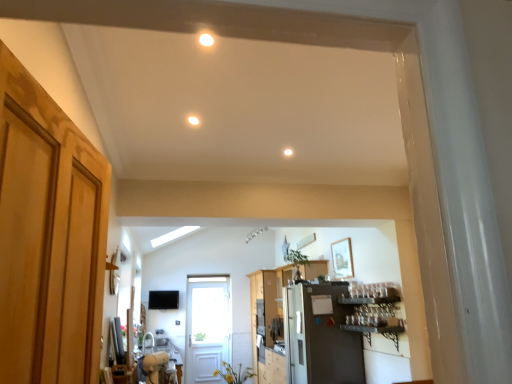
Locate an element on the screen. The height and width of the screenshot is (384, 512). metallic gray shelf at right is located at coordinates (375, 313).

Where is `matte white light fixture at center, arranged as the 2th lighting when viewed from the top`? Image resolution: width=512 pixels, height=384 pixels. matte white light fixture at center, arranged as the 2th lighting when viewed from the top is located at coordinates (193, 121).

Considering the relative positions of wooden cabinet at center and metallic gray shelf at right in the image provided, is wooden cabinet at center to the left or to the right of metallic gray shelf at right?

From the image, it's evident that wooden cabinet at center is to the left of metallic gray shelf at right.

Considering the sizes of objects wooden cabinet at center and metallic gray shelf at right in the image provided, who is taller, wooden cabinet at center or metallic gray shelf at right?

wooden cabinet at center.

In order to click on cabinetry behind the metallic gray shelf at right in this screenshot , I will do `click(267, 315)`.

Between point (261, 333) and point (355, 328), which one is positioned in front?

The point (355, 328) is closer.

From the image's perspective, is white matte light fixture at center, the first lighting in the bottom-to-top sequence, on white glossy light fixture at upper center, acting as the 1th lighting starting from the top?

No.

Does white matte light fixture at center, placed as the 3th lighting when sorted from top to bottom, touch white glossy light fixture at upper center, positioned as the 2th lighting in right-to-left order?

No, white matte light fixture at center, placed as the 3th lighting when sorted from top to bottom, is not next to white glossy light fixture at upper center, positioned as the 2th lighting in right-to-left order.

Is white matte light fixture at center, placed as the 3th lighting when sorted from top to bottom, inside or outside of white glossy light fixture at upper center, the 1th lighting from the front?

white matte light fixture at center, placed as the 3th lighting when sorted from top to bottom, is not enclosed by white glossy light fixture at upper center, the 1th lighting from the front.

In terms of height, does light brown wood door at left, which is the 1th door from top to bottom, look taller or shorter compared to wooden cabinet at center?

In the image, light brown wood door at left, which is the 1th door from top to bottom, appears to be shorter than wooden cabinet at center.

From the image's perspective, relative to wooden cabinet at center, is light brown wood door at left, which is the 1th door from top to bottom, above or below?

Clearly, from the image's perspective, light brown wood door at left, which is the 1th door from top to bottom, is above wooden cabinet at center.

In the scene shown: Can you tell me how much light brown wood door at left, the second door from the bottom, and wooden cabinet at center differ in facing direction?

170 degrees separate the facing orientations of light brown wood door at left, the second door from the bottom, and wooden cabinet at center.

The height and width of the screenshot is (384, 512). I want to click on door in front of the wooden cabinet at center, so click(x=48, y=237).

Is white matte light fixture at center, placed as the 3th lighting when sorted from top to bottom, bigger than white glossy sink at lower left?

No, white matte light fixture at center, placed as the 3th lighting when sorted from top to bottom, is not bigger than white glossy sink at lower left.

How different are the orientations of white matte light fixture at center, arranged as the 1th lighting when viewed from the right, and white glossy sink at lower left in degrees?

The angle between the facing direction of white matte light fixture at center, arranged as the 1th lighting when viewed from the right, and the facing direction of white glossy sink at lower left is 76.1 degrees.

Consider the image. Considering the relative positions of white matte light fixture at center, which is the first lighting in back-to-front order, and white glossy sink at lower left in the image provided, is white matte light fixture at center, which is the first lighting in back-to-front order, to the right of white glossy sink at lower left from the viewer's perspective?

Indeed, white matte light fixture at center, which is the first lighting in back-to-front order, is positioned on the right side of white glossy sink at lower left.

Can you confirm if white matte light fixture at center, arranged as the 1th lighting when viewed from the right, is wider than white glossy sink at lower left?

No.

From a real-world perspective, is light brown wood door at left, the first door in the front-to-back sequence, positioned above or below white matte light fixture at center, which is the first lighting in back-to-front order?

From a real-world perspective, light brown wood door at left, the first door in the front-to-back sequence, is physically below white matte light fixture at center, which is the first lighting in back-to-front order.

How distant is light brown wood door at left, the first door in the front-to-back sequence, from white matte light fixture at center, the first lighting in the bottom-to-top sequence?

They are 8.58 feet apart.

Is point (0, 145) less distant than point (283, 152)?

Yes, it is.

Identify the location of the 2nd lighting above the metallic gray shelf at right (from a real-world perspective). (193, 121).

Is the surface of matte white light fixture at center, the first lighting in the left-to-right sequence, in direct contact with metallic gray shelf at right?

matte white light fixture at center, the first lighting in the left-to-right sequence, is not next to metallic gray shelf at right, and they're not touching.

Between matte white light fixture at center, which ranks as the second lighting in back-to-front order, and metallic gray shelf at right, which one has larger size?

metallic gray shelf at right is bigger.

Considering the positions of point (194, 120) and point (393, 319), is point (194, 120) closer or farther from the camera than point (393, 319)?

Point (194, 120) is closer to the camera than point (393, 319).

Consider the image. From a real-world perspective, who is located higher, white wooden door at center, which is counted as the first door, starting from the back, or light brown wood door at left, the second door from the bottom?

In real-world perspective, light brown wood door at left, the second door from the bottom, is above.

Is white wooden door at center, the first door in the left-to-right sequence, facing towards light brown wood door at left, the second door from the bottom?

Yes, white wooden door at center, the first door in the left-to-right sequence, is oriented towards light brown wood door at left, the second door from the bottom.

Identify the location of cabinetry on the left of metallic gray shelf at right. tap(267, 315).

From the image's perspective, which lighting is the 2nd one below the white glossy light fixture at upper center, acting as the second lighting starting from the left? Please provide its 2D coordinates.

[(288, 152)]

From the image, which object appears to be farther from wooden cabinet at center, white matte light fixture at center, the 3th lighting from the front, or white wooden door at center, placed as the 2th door when sorted from front to back?

white matte light fixture at center, the 3th lighting from the front.

From the image, which object appears to be farther from matte white light fixture at center, arranged as the 2th lighting when viewed from the top, white matte light fixture at center, the third lighting viewed from the left, or metallic gray shelf at right?

metallic gray shelf at right.

Looking at the image, which one is located further to metallic gray shelf at right, white matte light fixture at center, the third lighting viewed from the left, or white glossy table at lower center?

white glossy table at lower center is positioned further to the anchor metallic gray shelf at right.

Based on their spatial positions, is satin silver refrigerator at center or wooden cabinet at center further from white matte light fixture at center, placed as the 3th lighting when sorted from top to bottom?

Based on the image, wooden cabinet at center appears to be further to white matte light fixture at center, placed as the 3th lighting when sorted from top to bottom.

From the image, which object appears to be farther from matte white light fixture at center, arranged as the 2th lighting when viewed from the top, white glossy sink at lower left or white glossy light fixture at upper center, acting as the second lighting starting from the left?

white glossy sink at lower left.

From the image, which object appears to be farther from metallic gray shelf at right, white glossy sink at lower left or white wooden door at center, the 2th door positioned from the right?

Among the two, white glossy sink at lower left is located further to metallic gray shelf at right.

Looking at the image, which one is located closer to wooden cabinet at center, white glossy light fixture at upper center, acting as the second lighting starting from the left, or matte white light fixture at center, the first lighting in the left-to-right sequence?

Based on the image, matte white light fixture at center, the first lighting in the left-to-right sequence, appears to be nearer to wooden cabinet at center.

From the image, which object appears to be farther from white matte light fixture at center, the 3th lighting from the front, white glossy light fixture at upper center, the 1th lighting from the front, or white glossy table at lower center?

white glossy table at lower center.

Find the location of a particular element. Image resolution: width=512 pixels, height=384 pixels. appliance between white glossy light fixture at upper center, the 1th lighting from the front, and wooden cabinet at center from front to back is located at coordinates (320, 336).

Identify the location of shelf between white glossy light fixture at upper center, positioned as the 2th lighting in right-to-left order, and white glossy sink at lower left, along the z-axis. The width and height of the screenshot is (512, 384). (375, 313).

The image size is (512, 384). What are the coordinates of `table located between white glossy light fixture at upper center, the third lighting ordered from the bottom, and white glossy sink at lower left in the depth direction` in the screenshot? It's located at (158, 369).

You are a GUI agent. You are given a task and a screenshot of the screen. Output one action in this format:
    pyautogui.click(x=<x>, y=<y>)
    Task: Click on the cabinetry positioned between matte white light fixture at center, positioned as the 2th lighting in bottom-to-top order, and white wooden door at center, which is counted as the first door, starting from the back, from near to far
    The image size is (512, 384).
    Given the screenshot: What is the action you would take?
    pyautogui.click(x=267, y=315)